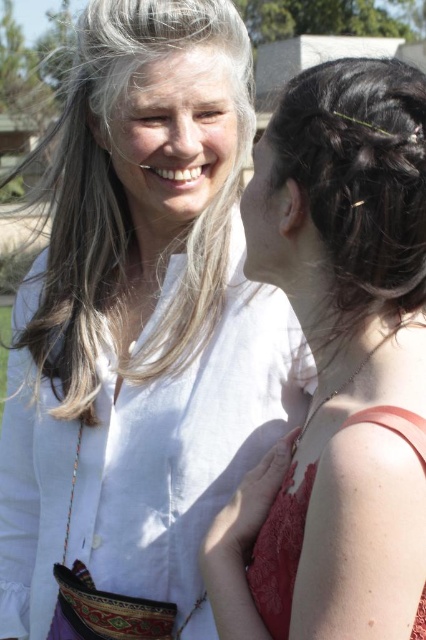
Question: Which object is farther from the camera taking this photo?

Choices:
 (A) lace fabric dress at lower right
 (B) matte white blouse at upper center
 (C) white linen shirt at upper center
 (D) dark brown textured hair at upper right

Answer: (C)

Question: Which of the following is the closest to the observer?

Choices:
 (A) (310, 381)
 (B) (301, 182)
 (C) (250, 561)
 (D) (29, 344)

Answer: (B)

Question: Can you confirm if gray smooth hair at upper left is wider than dark brown textured hair at upper right?

Choices:
 (A) yes
 (B) no

Answer: (A)

Question: Is gray smooth hair at upper left smaller than lace fabric dress at lower right?

Choices:
 (A) no
 (B) yes

Answer: (A)

Question: Considering the real-world distances, which object is farthest from the gray smooth hair at upper left?

Choices:
 (A) lace fabric dress at lower right
 (B) white linen shirt at upper center

Answer: (A)

Question: Does matte white blouse at upper center come behind gray smooth hair at upper left?

Choices:
 (A) no
 (B) yes

Answer: (A)